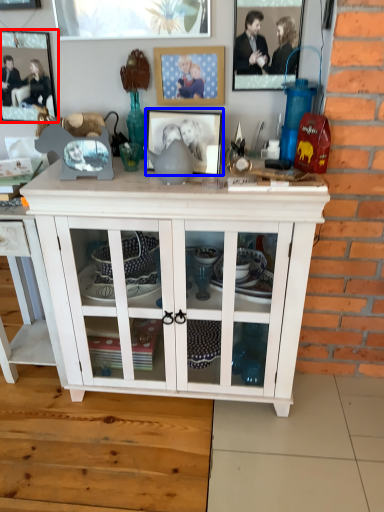
Question: Among these objects, which one is nearest to the camera, picture frame (highlighted by a red box) or picture frame (highlighted by a blue box)?

Choices:
 (A) picture frame
 (B) picture frame

Answer: (B)